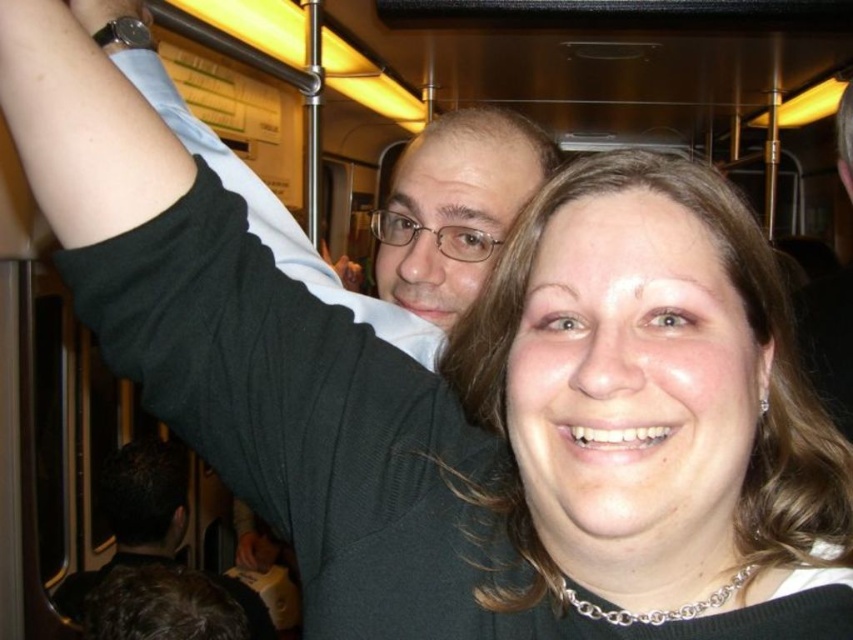
Can you confirm if matte black sweater at center is thinner than black matte hair at upper center?

Correct, matte black sweater at center's width is less than black matte hair at upper center's.

Does matte black sweater at center have a greater height compared to black matte hair at upper center?

No, matte black sweater at center is not taller than black matte hair at upper center.

Who is more forward, (x=705, y=188) or (x=146, y=496)?

Positioned in front is point (x=705, y=188).

Image resolution: width=853 pixels, height=640 pixels. I want to click on matte black sweater at center, so click(x=753, y=342).